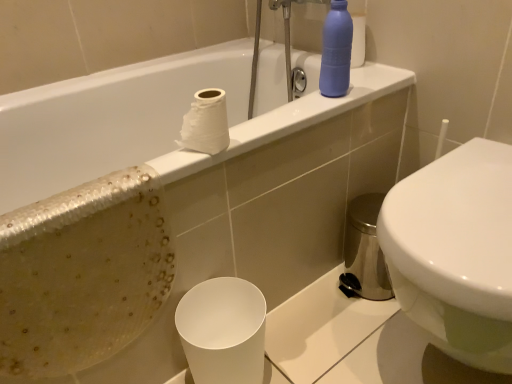
I want to click on vacant area that lies between matte blue bottle at upper right and white matte toilet paper at upper center, so click(x=282, y=121).